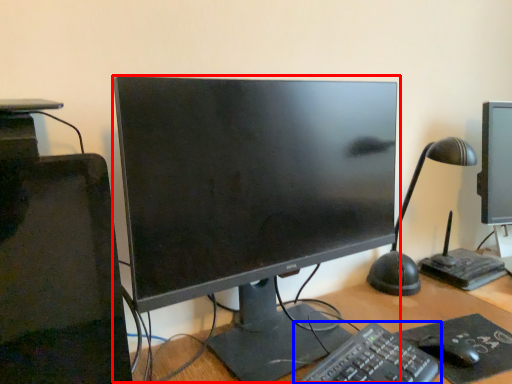
Question: Which of the following is the farthest to the observer, computer monitor (highlighted by a red box) or computer keyboard (highlighted by a blue box)?

Choices:
 (A) computer monitor
 (B) computer keyboard

Answer: (A)